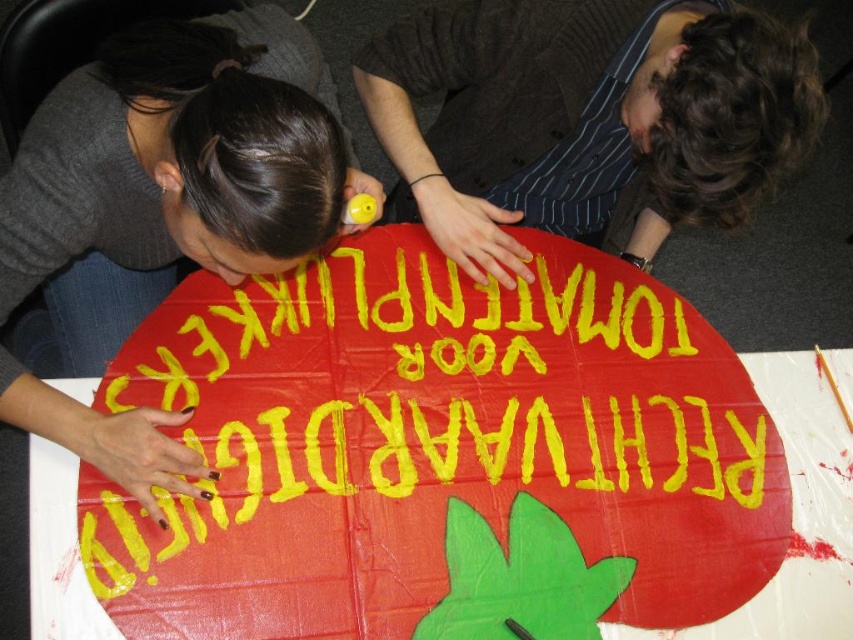
Does matte cardboard sign at center have a smaller size compared to dark brown striped shirt at upper center?

Actually, matte cardboard sign at center might be larger than dark brown striped shirt at upper center.

Is matte cardboard sign at center behind dark brown striped shirt at upper center?

Yes, matte cardboard sign at center is behind dark brown striped shirt at upper center.

Describe the element at coordinates (433, 444) in the screenshot. I see `matte cardboard sign at center` at that location.

The height and width of the screenshot is (640, 853). Find the location of `matte cardboard sign at center`. matte cardboard sign at center is located at coordinates (433, 444).